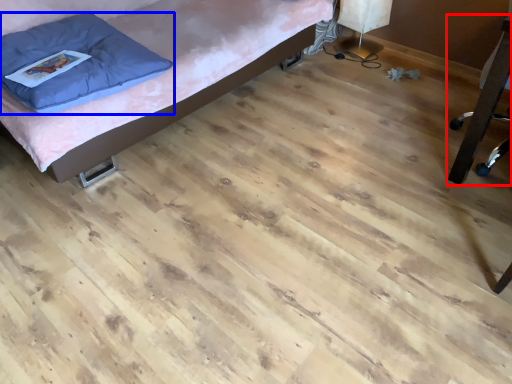
Question: Which object is further to the camera taking this photo, furniture (highlighted by a red box) or pillow (highlighted by a blue box)?

Choices:
 (A) furniture
 (B) pillow

Answer: (B)